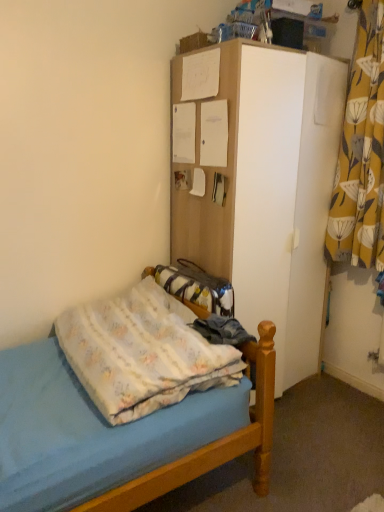
Find the location of `yellow floral fabric curtain at right`. yellow floral fabric curtain at right is located at coordinates (361, 152).

Find the location of a particular element. fluffy cotton blanket at lower left is located at coordinates (141, 352).

Can you confirm if yellow floral fabric curtain at right is smaller than fluffy cotton blanket at lower left?

Yes.

Is yellow floral fabric curtain at right located outside fluffy cotton blanket at lower left?

Indeed, yellow floral fabric curtain at right is completely outside fluffy cotton blanket at lower left.

Which point is more forward, (354, 256) or (99, 325)?

The point (99, 325) is more forward.

Is light blue fabric bed at lower left spatially inside fluffy cotton blanket at lower left, or outside of it?

light blue fabric bed at lower left is located beyond the bounds of fluffy cotton blanket at lower left.

Does point (229, 408) come behind point (188, 308)?

No, it is not.

From a real-world perspective, is light blue fabric bed at lower left physically located above or below fluffy cotton blanket at lower left?

light blue fabric bed at lower left is situated lower than fluffy cotton blanket at lower left in the real world.

The width and height of the screenshot is (384, 512). Find the location of `bedding located above the light blue fabric bed at lower left (from the image's perspective)`. bedding located above the light blue fabric bed at lower left (from the image's perspective) is located at coordinates (141, 352).

Which of these two, fluffy cotton blanket at lower left or white matte cabinet at upper center, is thinner?

fluffy cotton blanket at lower left.

Does fluffy cotton blanket at lower left have a larger size compared to white matte cabinet at upper center?

No, fluffy cotton blanket at lower left is not bigger than white matte cabinet at upper center.

Can we say fluffy cotton blanket at lower left lies outside white matte cabinet at upper center?

Yes.

Is yellow floral fabric curtain at right wider or thinner than white matte cabinet at upper center?

yellow floral fabric curtain at right is thinner than white matte cabinet at upper center.

Is yellow floral fabric curtain at right further to the viewer compared to white matte cabinet at upper center?

Yes, it is.

Could white matte cabinet at upper center be considered to be inside yellow floral fabric curtain at right?

No, white matte cabinet at upper center is not surrounded by yellow floral fabric curtain at right.

Could you tell me if yellow floral fabric curtain at right is turned towards white matte cabinet at upper center?

No, yellow floral fabric curtain at right does not turn towards white matte cabinet at upper center.

Based on the photo, is yellow floral fabric curtain at right in front of or behind light blue fabric bed at lower left in the image?

yellow floral fabric curtain at right is positioned farther from the viewer than light blue fabric bed at lower left.

From the image's perspective, which object appears higher, yellow floral fabric curtain at right or light blue fabric bed at lower left?

From the image's view, yellow floral fabric curtain at right is above.

Considering the positions of objects yellow floral fabric curtain at right and light blue fabric bed at lower left in the image provided, who is more to the left, yellow floral fabric curtain at right or light blue fabric bed at lower left?

Positioned to the left is light blue fabric bed at lower left.

Which object is wider, yellow floral fabric curtain at right or light blue fabric bed at lower left?

light blue fabric bed at lower left.

Is light blue fabric bed at lower left placed right next to yellow floral fabric curtain at right?

There is a gap between light blue fabric bed at lower left and yellow floral fabric curtain at right.

Does light blue fabric bed at lower left lie behind yellow floral fabric curtain at right?

No, it is not.

From a real-world perspective, which object stands above the other?

In real-world perspective, yellow floral fabric curtain at right is above.

How distant is light blue fabric bed at lower left from yellow floral fabric curtain at right?

The distance of light blue fabric bed at lower left from yellow floral fabric curtain at right is 4.68 feet.

Can we say light blue fabric bed at lower left lies outside white matte cabinet at upper center?

light blue fabric bed at lower left lies outside white matte cabinet at upper center's area.

Based on their positions, is light blue fabric bed at lower left located to the left or right of white matte cabinet at upper center?

From the image, it's evident that light blue fabric bed at lower left is to the left of white matte cabinet at upper center.

Based on the photo, how different are the orientations of light blue fabric bed at lower left and white matte cabinet at upper center in degrees?

light blue fabric bed at lower left and white matte cabinet at upper center are facing 87.8 degrees away from each other.

Is light blue fabric bed at lower left turned away from white matte cabinet at upper center?

No, light blue fabric bed at lower left's orientation is not away from white matte cabinet at upper center.

Find the location of a particular element. curtain lying behind the fluffy cotton blanket at lower left is located at coordinates (361, 152).

Where is `bedding located above the light blue fabric bed at lower left (from a real-world perspective)`? Image resolution: width=384 pixels, height=512 pixels. bedding located above the light blue fabric bed at lower left (from a real-world perspective) is located at coordinates (141, 352).

Estimate the real-world distances between objects in this image. Which object is further from white matte cabinet at upper center, light blue fabric bed at lower left or fluffy cotton blanket at lower left?

Based on the image, light blue fabric bed at lower left appears to be further to white matte cabinet at upper center.

Based on their spatial positions, is fluffy cotton blanket at lower left or light blue fabric bed at lower left closer to yellow floral fabric curtain at right?

Among the two, fluffy cotton blanket at lower left is located nearer to yellow floral fabric curtain at right.

Which object lies further to the anchor point yellow floral fabric curtain at right, white matte cabinet at upper center or fluffy cotton blanket at lower left?

Among the two, fluffy cotton blanket at lower left is located further to yellow floral fabric curtain at right.

Estimate the real-world distances between objects in this image. Which object is closer to light blue fabric bed at lower left, fluffy cotton blanket at lower left or yellow floral fabric curtain at right?

fluffy cotton blanket at lower left is closer to light blue fabric bed at lower left.

Considering their positions, is white matte cabinet at upper center positioned further to fluffy cotton blanket at lower left than yellow floral fabric curtain at right?

Among the two, yellow floral fabric curtain at right is located further to fluffy cotton blanket at lower left.

Which object lies nearer to the anchor point white matte cabinet at upper center, fluffy cotton blanket at lower left or yellow floral fabric curtain at right?

Among the two, yellow floral fabric curtain at right is located nearer to white matte cabinet at upper center.

Estimate the real-world distances between objects in this image. Which object is closer to light blue fabric bed at lower left, white matte cabinet at upper center or yellow floral fabric curtain at right?

white matte cabinet at upper center is positioned closer to the anchor light blue fabric bed at lower left.

Estimate the real-world distances between objects in this image. Which object is closer to fluffy cotton blanket at lower left, yellow floral fabric curtain at right or light blue fabric bed at lower left?

light blue fabric bed at lower left.

Find the location of a particular element. dresser situated between light blue fabric bed at lower left and yellow floral fabric curtain at right from left to right is located at coordinates (267, 192).

The image size is (384, 512). What are the coordinates of `bedding between light blue fabric bed at lower left and white matte cabinet at upper center in the horizontal direction` in the screenshot? It's located at (141, 352).

The image size is (384, 512). Find the location of `bedding located between light blue fabric bed at lower left and yellow floral fabric curtain at right in the left-right direction`. bedding located between light blue fabric bed at lower left and yellow floral fabric curtain at right in the left-right direction is located at coordinates (141, 352).

This screenshot has height=512, width=384. I want to click on dresser between fluffy cotton blanket at lower left and yellow floral fabric curtain at right, so click(267, 192).